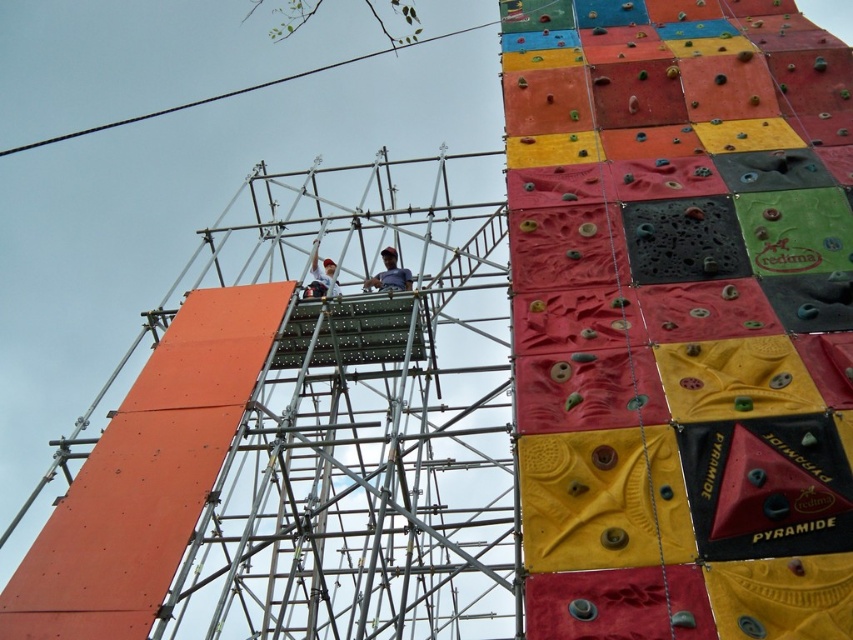
You are a safety inspector checking the distance between the matte black helmet at center and the white matte shirt at center on the scaffolding. According to safety regulations, the minimum distance between two workers should be at least 5 meters to prevent collision. Is the current distance compliant with the safety regulations?

The matte black helmet at center and white matte shirt at center are 4.49 meters apart, which is less than the required 5 meters. Therefore, the current distance does not comply with the safety regulations.

You are a safety inspector at the construction site of the climbing wall. You need to ensure that the metallic scaffolding at center is positioned at least 150 feet away from the edge of the construction area for safety. Can you confirm if the distance meets the safety requirement?

The distance between the metallic scaffolding at center and the viewer is 160.72 feet. Since the safety requirement is at least 150 feet, the scaffolding meets the safety distance requirement.

You are a safety inspector at the construction site. You need to ensure that the distance between the metallic scaffolding at center and the white matte shirt at center meets the safety regulations. According to the safety guidelines, the minimum safe distance between workers and the scaffolding should be at least 18 meters. Is the current distance compliant with the regulations?

The metallic scaffolding at center is 17.33 meters away from the white matte shirt at center. Since 17.33 meters is less than the required 18 meters, the current distance does not comply with the safety regulations.